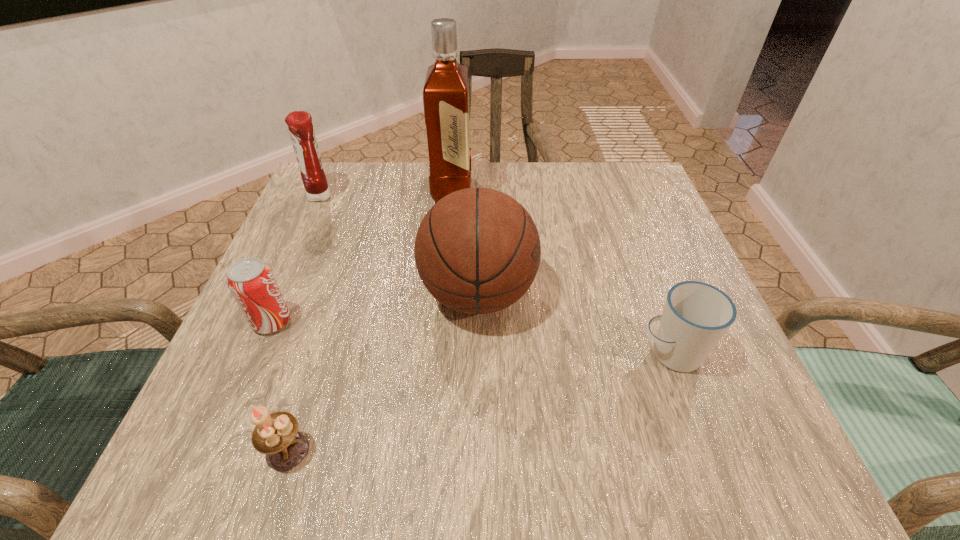
The width and height of the screenshot is (960, 540). Identify the location of candle holder that is at the left edge. (276, 435).

The image size is (960, 540). I want to click on object situated at the right edge, so click(696, 315).

This screenshot has width=960, height=540. I want to click on object at the far left corner, so click(x=301, y=130).

This screenshot has height=540, width=960. I want to click on object that is at the near left corner, so click(276, 435).

In the image, there is a desktop. At what (x,y) coordinates should I click in order to perform the action: click on free space at the far edge. Please return your answer as a coordinate pair (x, y). The image size is (960, 540). Looking at the image, I should click on (561, 197).

You are a GUI agent. You are given a task and a screenshot of the screen. Output one action in this format:
    pyautogui.click(x=<x>, y=<y>)
    Task: Click on the blank space at the near edge
    
    Given the screenshot: What is the action you would take?
    pyautogui.click(x=526, y=434)

You are a GUI agent. You are given a task and a screenshot of the screen. Output one action in this format:
    pyautogui.click(x=<x>, y=<y>)
    Task: Click on the vacant space at the left edge of the desktop
    This screenshot has width=960, height=540.
    Given the screenshot: What is the action you would take?
    pyautogui.click(x=300, y=222)

Locate an element on the screen. This screenshot has height=540, width=960. vacant region at the right edge of the desktop is located at coordinates (609, 273).

Find the location of a particular element. free space at the far left corner of the desktop is located at coordinates (361, 211).

Image resolution: width=960 pixels, height=540 pixels. Find the location of `vacant region at the near right corner`. vacant region at the near right corner is located at coordinates (749, 422).